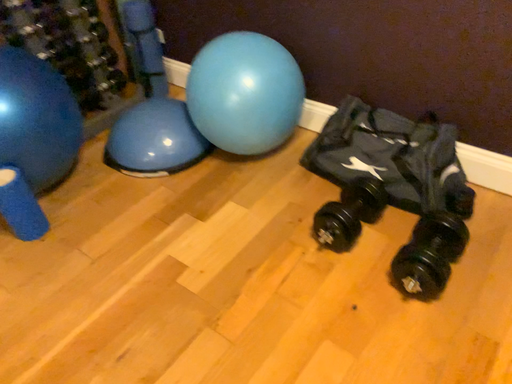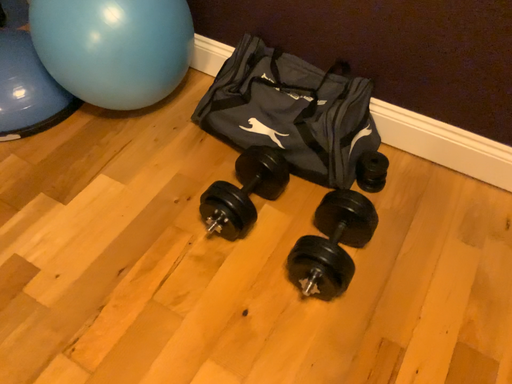
Question: Which way did the camera rotate in the video?

Choices:
 (A) rotated upward
 (B) rotated downward

Answer: (B)